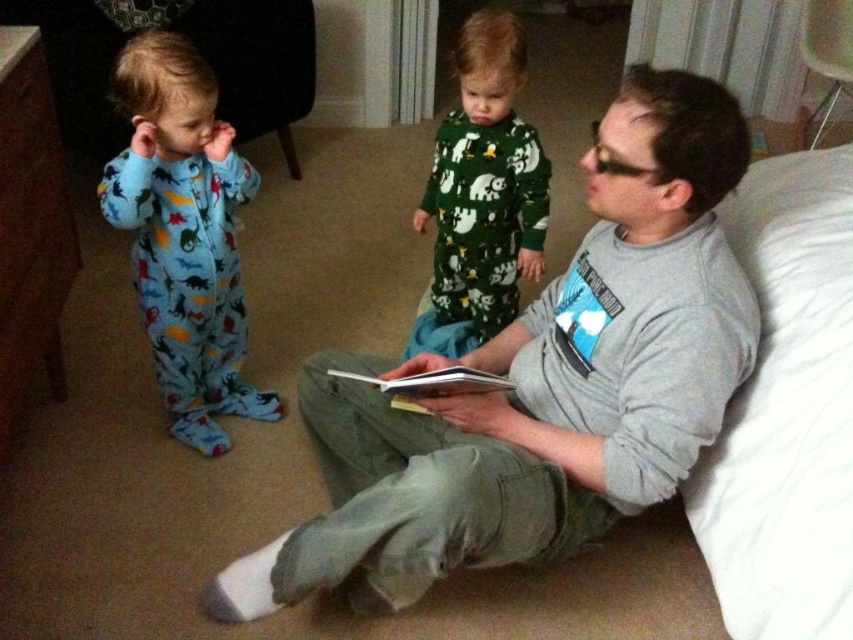
Question: Considering the real-world distances, which object is closest to the blue fleece onesie at left?

Choices:
 (A) green fuzzy pajamas at center
 (B) white soft pillow at right
 (C) gray cotton shirt at center

Answer: (A)

Question: Which object appears farthest from the camera in this image?

Choices:
 (A) blue fleece onesie at left
 (B) white soft pillow at right
 (C) green fuzzy pajamas at center
 (D) gray cotton shirt at center

Answer: (C)

Question: Is white soft pillow at right bigger than blue fleece onesie at left?

Choices:
 (A) yes
 (B) no

Answer: (A)

Question: Is gray cotton shirt at center further to camera compared to green fuzzy pajamas at center?

Choices:
 (A) yes
 (B) no

Answer: (B)

Question: Which object is positioned closest to the gray cotton shirt at center?

Choices:
 (A) white soft pillow at right
 (B) green fuzzy pajamas at center

Answer: (A)

Question: Considering the relative positions of gray cotton shirt at center and blue fleece onesie at left in the image provided, where is gray cotton shirt at center located with respect to blue fleece onesie at left?

Choices:
 (A) left
 (B) right

Answer: (B)